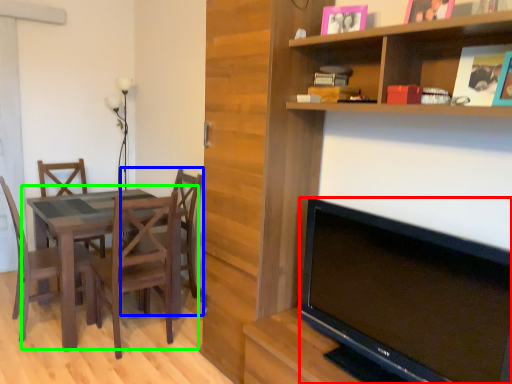
Question: Based on their relative distances, which object is farther from television (highlighted by a red box)? Choose from chair (highlighted by a blue box) and kitchen & dining room table (highlighted by a green box).

Choices:
 (A) chair
 (B) kitchen & dining room table

Answer: (A)